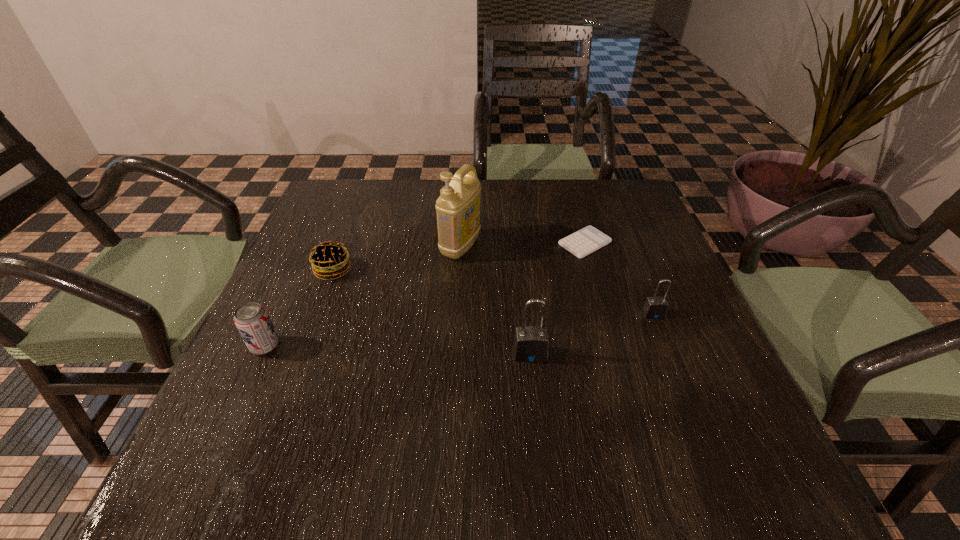
You are a GUI agent. You are given a task and a screenshot of the screen. Output one action in this format:
    pyautogui.click(x=<x>, y=<y>)
    Task: Click on the calculator that is at the right edge
    The height and width of the screenshot is (540, 960).
    Given the screenshot: What is the action you would take?
    pyautogui.click(x=587, y=240)

This screenshot has height=540, width=960. In order to click on vacant point at the far edge in this screenshot , I will do `click(505, 191)`.

At what (x,y) coordinates should I click in order to perform the action: click on vacant area at the near edge of the desktop. Please return your answer as a coordinate pair (x, y). The image size is (960, 540). Looking at the image, I should click on (561, 406).

Find the location of `blank space at the left edge of the desktop`. blank space at the left edge of the desktop is located at coordinates (248, 357).

Where is `vacant space at the right edge of the desktop`? Image resolution: width=960 pixels, height=540 pixels. vacant space at the right edge of the desktop is located at coordinates tap(635, 290).

Locate an element on the screen. The height and width of the screenshot is (540, 960). free space at the far left corner is located at coordinates (x=337, y=224).

At what (x,y) coordinates should I click in order to perform the action: click on vacant space at the far right corner of the desktop. Please return your answer as a coordinate pair (x, y). The height and width of the screenshot is (540, 960). Looking at the image, I should click on (614, 204).

Locate an element on the screen. free space between the fifth object from right to left and the beer can is located at coordinates (300, 308).

This screenshot has height=540, width=960. Find the location of `vacant point located between the fifth object from right to left and the second tallest object`. vacant point located between the fifth object from right to left and the second tallest object is located at coordinates (432, 312).

Locate an element on the screen. The image size is (960, 540). free space between the rightmost object and the nearer padlock is located at coordinates (591, 334).